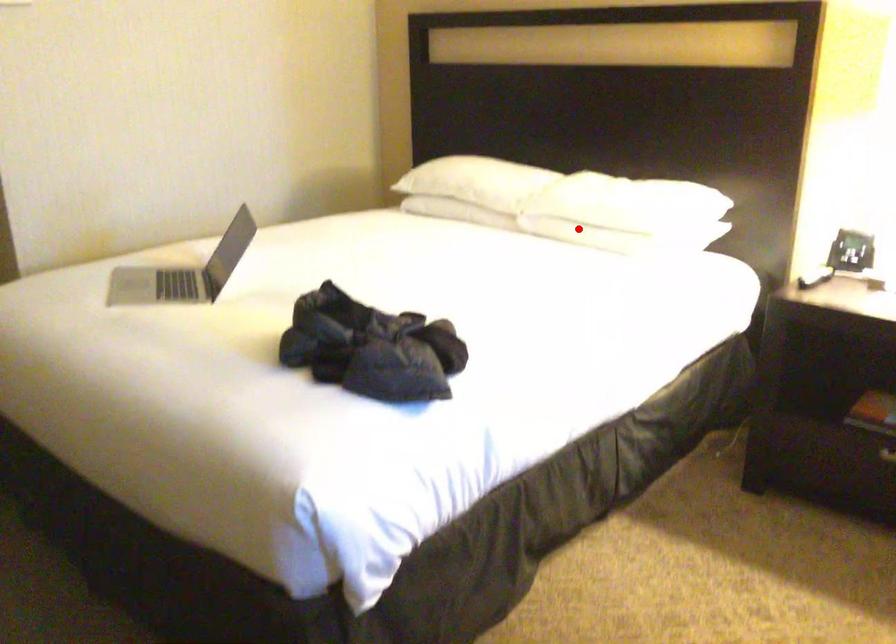
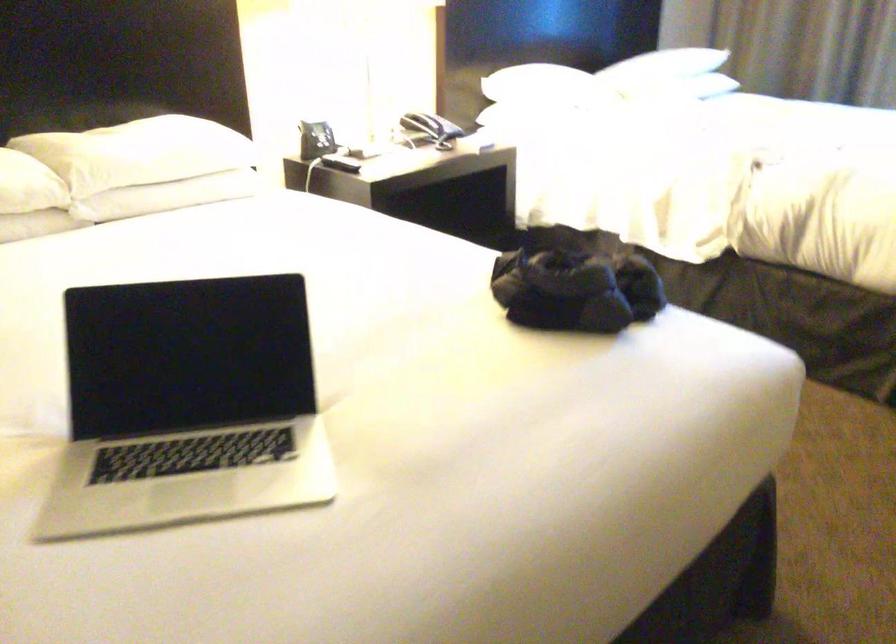
Question: I am providing you with two images of the same scene from different viewpoints. A red point is marked on the first image. Can you still see the location of the red point in image 2?

Choices:
 (A) Yes
 (B) No

Answer: (A)